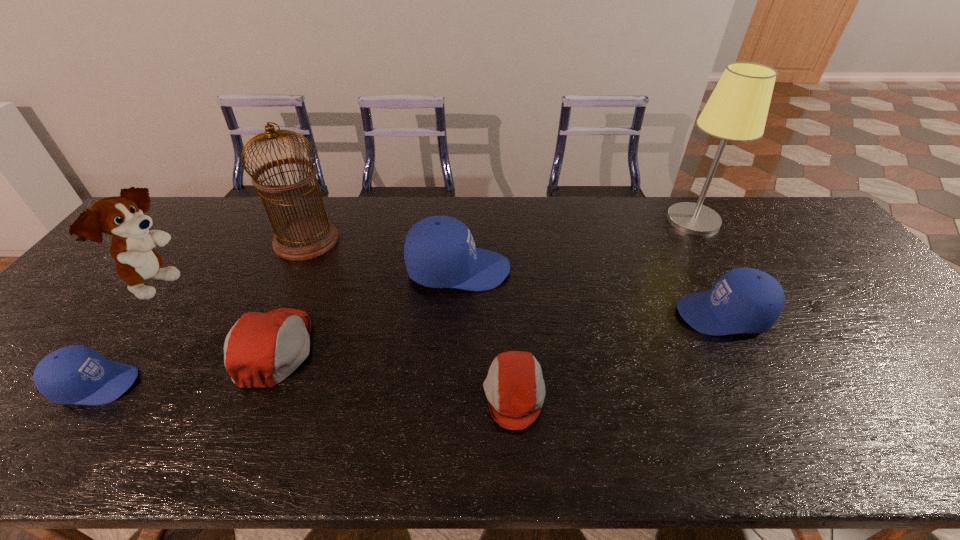
The height and width of the screenshot is (540, 960). I want to click on vacant space located 0.140m on the front-facing side of the second biggest blue cap, so coord(624,314).

At what (x,y) coordinates should I click in order to perform the action: click on vacant region located 0.080m on the front-facing side of the bigger red cap. Please return your answer as a coordinate pair (x, y). Looking at the image, I should click on (346, 348).

The width and height of the screenshot is (960, 540). I want to click on vacant area situated 0.230m on the front-facing side of the smallest blue cap, so click(x=237, y=384).

In order to click on vacant space located on the front-facing side of the shortest object in this screenshot , I will do `click(362, 395)`.

I want to click on blank area located on the front-facing side of the shortest object, so click(x=313, y=395).

The height and width of the screenshot is (540, 960). I want to click on blank area located on the front-facing side of the shortest object, so click(x=345, y=395).

Where is `table lamp positioned at the far edge`? The height and width of the screenshot is (540, 960). table lamp positioned at the far edge is located at coordinates (737, 110).

Image resolution: width=960 pixels, height=540 pixels. In order to click on birdcage located in the far edge section of the desktop in this screenshot , I will do `click(302, 238)`.

Where is `object present at the near edge`? object present at the near edge is located at coordinates (515, 389).

Find the location of a particular element. This screenshot has height=540, width=960. puppy that is positioned at the left edge is located at coordinates (122, 217).